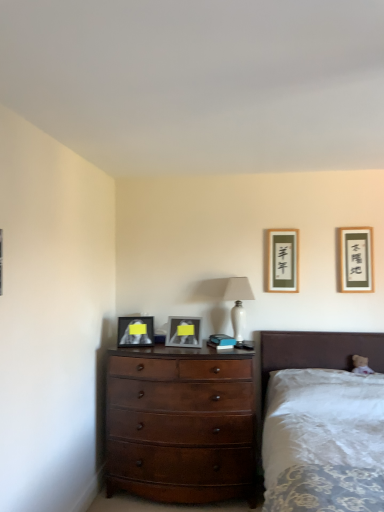
How much space does matte black picture frame at upper right, marked as the 1th picture frame in a right-to-left arrangement, occupy horizontally?

matte black picture frame at upper right, marked as the 1th picture frame in a right-to-left arrangement, is 4.28 centimeters in width.

Where is `white fabric bed at lower right`? This screenshot has height=512, width=384. white fabric bed at lower right is located at coordinates (316, 351).

In order to face matte silver picture frame at center, acting as the 3th picture frame starting from the right, should I rotate leftwards or rightwards?

Turn left by 0.975 degrees to look at matte silver picture frame at center, acting as the 3th picture frame starting from the right.

Measure the distance between mahogany wood dresser at center and camera.

A distance of 9.75 feet exists between mahogany wood dresser at center and camera.

Locate an element on the screen. Image resolution: width=384 pixels, height=512 pixels. white glossy table lamp at center is located at coordinates (238, 304).

What's the angular difference between matte black picture frame at upper right, which is the fourth picture frame from left to right, and matte black picture frame at upper right, the third picture frame from the left,'s facing directions?

0.00361 degrees.

Between matte black picture frame at upper right, which is the fourth picture frame from left to right, and matte black picture frame at upper right, the third picture frame from the left, which one has larger size?

Bigger between the two is matte black picture frame at upper right, the third picture frame from the left.

Between matte black picture frame at upper right, marked as the 1th picture frame in a right-to-left arrangement, and matte black picture frame at upper right, acting as the 2th picture frame starting from the right, which one appears on the left side from the viewer's perspective?

→ matte black picture frame at upper right, acting as the 2th picture frame starting from the right.

Does matte black picture frame at upper right, marked as the 1th picture frame in a right-to-left arrangement, have a lesser height compared to matte black picture frame at upper right, the third picture frame from the left?

Yes, matte black picture frame at upper right, marked as the 1th picture frame in a right-to-left arrangement, is shorter than matte black picture frame at upper right, the third picture frame from the left.

From the white glossy table lamp at center, count 2nd picture frames backward and point to it. Please provide its 2D coordinates.

[(283, 260)]

Is point (246, 297) positioned behind point (284, 290)?

That is True.

Can you confirm if white glossy table lamp at center is shorter than matte black picture frame at upper right, the third picture frame from the left?

No.

In terms of height, does white fabric bed at lower right look taller or shorter compared to mahogany wood dresser at center?

white fabric bed at lower right is taller than mahogany wood dresser at center.

Considering the positions of objects white fabric bed at lower right and mahogany wood dresser at center in the image provided, who is behind, white fabric bed at lower right or mahogany wood dresser at center?

mahogany wood dresser at center.

Does white fabric bed at lower right turn towards mahogany wood dresser at center?

No, white fabric bed at lower right does not turn towards mahogany wood dresser at center.

From a real-world perspective, is white fabric bed at lower right under mahogany wood dresser at center?

No, from a real-world perspective, white fabric bed at lower right is not under mahogany wood dresser at center.

Looking at this image, from the image's perspective, is matte black picture frame at upper right, acting as the 2th picture frame starting from the right, located above white glossy table lamp at center?

Yes, from the image's perspective, matte black picture frame at upper right, acting as the 2th picture frame starting from the right, is over white glossy table lamp at center.

Consider the image. Is matte black picture frame at upper right, acting as the 2th picture frame starting from the right, positioned before white glossy table lamp at center?

No, it is not.

From a real-world perspective, between matte black picture frame at upper right, acting as the 2th picture frame starting from the right, and white glossy table lamp at center, who is vertically higher?

matte black picture frame at upper right, acting as the 2th picture frame starting from the right.

Is matte black picture frame at upper right, which is the fourth picture frame from left to right, smaller than matte black picture frame at center, the first picture frame positioned from the left?

Yes, matte black picture frame at upper right, which is the fourth picture frame from left to right, is smaller than matte black picture frame at center, the first picture frame positioned from the left.

From a real-world perspective, relative to matte black picture frame at center, the fourth picture frame positioned from the right, is matte black picture frame at upper right, marked as the 1th picture frame in a right-to-left arrangement, vertically above or below?

In terms of real-world spatial position, matte black picture frame at upper right, marked as the 1th picture frame in a right-to-left arrangement, is above matte black picture frame at center, the fourth picture frame positioned from the right.

Which of these two, matte black picture frame at upper right, which is the fourth picture frame from left to right, or matte black picture frame at center, the fourth picture frame positioned from the right, stands taller?

matte black picture frame at upper right, which is the fourth picture frame from left to right, is taller.

Which is more to the left, matte black picture frame at upper right, marked as the 1th picture frame in a right-to-left arrangement, or matte black picture frame at center, the fourth picture frame positioned from the right?

Positioned to the left is matte black picture frame at center, the fourth picture frame positioned from the right.

Is matte black picture frame at upper right, the third picture frame from the left, positioned with its back to matte black picture frame at upper right, marked as the 1th picture frame in a right-to-left arrangement?

No, matte black picture frame at upper right, the third picture frame from the left, is not facing the opposite direction of matte black picture frame at upper right, marked as the 1th picture frame in a right-to-left arrangement.

In terms of width, does matte black picture frame at upper right, acting as the 2th picture frame starting from the right, look wider or thinner when compared to matte black picture frame at upper right, which is the fourth picture frame from left to right?

Considering their sizes, matte black picture frame at upper right, acting as the 2th picture frame starting from the right, looks broader than matte black picture frame at upper right, which is the fourth picture frame from left to right.

What's the angular difference between matte black picture frame at upper right, acting as the 2th picture frame starting from the right, and matte black picture frame at upper right, which is the fourth picture frame from left to right,'s facing directions?

The angle between the facing direction of matte black picture frame at upper right, acting as the 2th picture frame starting from the right, and the facing direction of matte black picture frame at upper right, which is the fourth picture frame from left to right, is 0.00361 degrees.

You are a GUI agent. You are given a task and a screenshot of the screen. Output one action in this format:
    pyautogui.click(x=<x>, y=<y>)
    Task: Click on the picture frame behind the matte black picture frame at upper right, which is the fourth picture frame from left to right
    
    Given the screenshot: What is the action you would take?
    pyautogui.click(x=283, y=260)

Image resolution: width=384 pixels, height=512 pixels. Identify the location of the 3rd picture frame located above the matte black picture frame at center, the first picture frame positioned from the left (from a real-world perspective). (283, 260).

From a real-world perspective, relative to matte black picture frame at upper right, the third picture frame from the left, is matte black picture frame at center, the first picture frame positioned from the left, vertically above or below?

In terms of real-world spatial position, matte black picture frame at center, the first picture frame positioned from the left, is below matte black picture frame at upper right, the third picture frame from the left.

Considering the sizes of objects matte black picture frame at center, the first picture frame positioned from the left, and matte black picture frame at upper right, the third picture frame from the left, in the image provided, who is bigger, matte black picture frame at center, the first picture frame positioned from the left, or matte black picture frame at upper right, the third picture frame from the left,?

Bigger between the two is matte black picture frame at center, the first picture frame positioned from the left.

Where is `the 1st picture frame to the left when counting from the matte black picture frame at upper right, which is the fourth picture frame from left to right`? This screenshot has height=512, width=384. the 1st picture frame to the left when counting from the matte black picture frame at upper right, which is the fourth picture frame from left to right is located at coordinates (283, 260).

Image resolution: width=384 pixels, height=512 pixels. Identify the location of table lamp that appears below the matte black picture frame at upper right, acting as the 2th picture frame starting from the right (from the image's perspective). (238, 304).

Considering their positions, is matte black picture frame at center, the fourth picture frame positioned from the right, positioned closer to white fabric bed at lower right than white glossy table lamp at center?

white glossy table lamp at center is closer to white fabric bed at lower right.

Which object lies nearer to the anchor point white fabric bed at lower right, matte silver picture frame at center, the 2th picture frame when ordered from left to right, or matte black picture frame at center, the fourth picture frame positioned from the right?

matte silver picture frame at center, the 2th picture frame when ordered from left to right, is closer to white fabric bed at lower right.

Estimate the real-world distances between objects in this image. Which object is further from white glossy table lamp at center, matte black picture frame at upper right, marked as the 1th picture frame in a right-to-left arrangement, or matte silver picture frame at center, acting as the 3th picture frame starting from the right?

matte black picture frame at upper right, marked as the 1th picture frame in a right-to-left arrangement, is positioned further to the anchor white glossy table lamp at center.

From the image, which object appears to be nearer to matte silver picture frame at center, acting as the 3th picture frame starting from the right, matte black picture frame at upper right, acting as the 2th picture frame starting from the right, or matte black picture frame at center, the first picture frame positioned from the left?

Based on the image, matte black picture frame at center, the first picture frame positioned from the left, appears to be nearer to matte silver picture frame at center, acting as the 3th picture frame starting from the right.

Which object lies nearer to the anchor point matte silver picture frame at center, acting as the 3th picture frame starting from the right, white fabric bed at lower right or mahogany wood dresser at center?

mahogany wood dresser at center is positioned closer to the anchor matte silver picture frame at center, acting as the 3th picture frame starting from the right.

Looking at the image, which one is located further to matte black picture frame at upper right, the third picture frame from the left, white glossy table lamp at center or matte black picture frame at upper right, which is the fourth picture frame from left to right?

matte black picture frame at upper right, which is the fourth picture frame from left to right, is positioned further to the anchor matte black picture frame at upper right, the third picture frame from the left.

Estimate the real-world distances between objects in this image. Which object is further from mahogany wood dresser at center, matte silver picture frame at center, acting as the 3th picture frame starting from the right, or white glossy table lamp at center?

white glossy table lamp at center lies further to mahogany wood dresser at center than the other object.

Looking at the image, which one is located further to matte black picture frame at upper right, the third picture frame from the left, matte black picture frame at center, the fourth picture frame positioned from the right, or mahogany wood dresser at center?

mahogany wood dresser at center lies further to matte black picture frame at upper right, the third picture frame from the left, than the other object.

What are the coordinates of `table lamp positioned between white fabric bed at lower right and matte black picture frame at upper right, which is the fourth picture frame from left to right, from near to far` in the screenshot? It's located at (238, 304).

You are a GUI agent. You are given a task and a screenshot of the screen. Output one action in this format:
    pyautogui.click(x=<x>, y=<y>)
    Task: Click on the picture frame situated between matte black picture frame at center, the fourth picture frame positioned from the right, and white glossy table lamp at center from left to right
    
    Given the screenshot: What is the action you would take?
    pyautogui.click(x=183, y=332)

The width and height of the screenshot is (384, 512). Identify the location of table lamp between matte black picture frame at center, the first picture frame positioned from the left, and matte black picture frame at upper right, acting as the 2th picture frame starting from the right, from left to right. (238, 304).

Where is `picture frame between white fabric bed at lower right and matte black picture frame at center, the fourth picture frame positioned from the right, in the front-back direction`? picture frame between white fabric bed at lower right and matte black picture frame at center, the fourth picture frame positioned from the right, in the front-back direction is located at coordinates (183, 332).